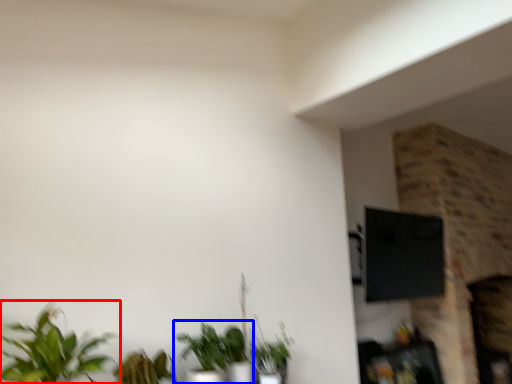
Question: Which point is closer to the camera, houseplant (highlighted by a red box) or houseplant (highlighted by a blue box)?

Choices:
 (A) houseplant
 (B) houseplant

Answer: (A)